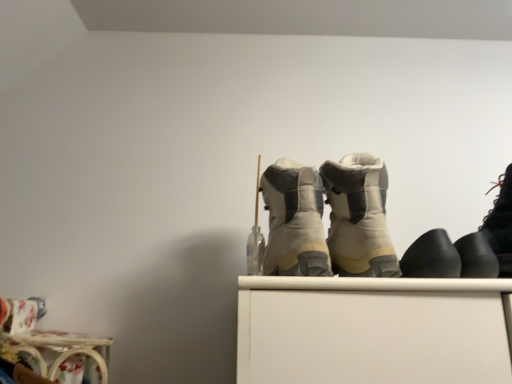
Question: From a real-world perspective, is black leather boot at right, positioned as the first footwear in right-to-left order, beneath black rubber shoes at right, which is the fourth footwear from left to right?

Choices:
 (A) no
 (B) yes

Answer: (A)

Question: Is black leather boot at right, positioned as the first footwear in right-to-left order, in front of black rubber shoes at right, the 2th footwear positioned from the right?

Choices:
 (A) no
 (B) yes

Answer: (B)

Question: Is black leather boot at right, positioned as the first footwear in right-to-left order, thinner than black rubber shoes at right, which is the fourth footwear from left to right?

Choices:
 (A) no
 (B) yes

Answer: (A)

Question: From a real-world perspective, is black leather boot at right, the fifth footwear positioned from the left, on top of black rubber shoes at right, which is the fourth footwear from left to right?

Choices:
 (A) yes
 (B) no

Answer: (A)

Question: Does black leather boot at right, positioned as the first footwear in right-to-left order, have a lesser height compared to black rubber shoes at right, the 2th footwear positioned from the right?

Choices:
 (A) no
 (B) yes

Answer: (A)

Question: Could you tell me if black leather boot at right, the fifth footwear positioned from the left, is facing black rubber shoes at right, the 2th footwear positioned from the right?

Choices:
 (A) no
 (B) yes

Answer: (A)

Question: Is beige suede boots at center, which appears as the fourth footwear when viewed from the right, positioned before beige suede boots at center, which is counted as the 1th footwear, starting from the left?

Choices:
 (A) no
 (B) yes

Answer: (A)

Question: From a real-world perspective, is beige suede boots at center, positioned as the second footwear in left-to-right order, on beige suede boots at center, which is counted as the 1th footwear, starting from the left?

Choices:
 (A) yes
 (B) no

Answer: (A)

Question: From a real-world perspective, is beige suede boots at center, which appears as the fourth footwear when viewed from the right, positioned under beige suede boots at center, which is counted as the 1th footwear, starting from the left, based on gravity?

Choices:
 (A) no
 (B) yes

Answer: (A)

Question: Considering the relative sizes of beige suede boots at center, which appears as the fourth footwear when viewed from the right, and beige suede boots at center, placed as the fifth footwear when sorted from right to left, in the image provided, is beige suede boots at center, which appears as the fourth footwear when viewed from the right, taller than beige suede boots at center, placed as the fifth footwear when sorted from right to left,?

Choices:
 (A) no
 (B) yes

Answer: (B)

Question: Is beige suede boots at center, positioned as the second footwear in left-to-right order, directly adjacent to beige suede boots at center, which is counted as the 1th footwear, starting from the left?

Choices:
 (A) yes
 (B) no

Answer: (A)

Question: From the image's perspective, does beige suede boots at center, positioned as the second footwear in left-to-right order, appear lower than beige suede boots at center, placed as the fifth footwear when sorted from right to left?

Choices:
 (A) no
 (B) yes

Answer: (B)

Question: From the image's perspective, is beige suede boots at center, which appears as the fourth footwear when viewed from the right, located beneath black matte boot at right, marked as the third footwear in a right-to-left arrangement?

Choices:
 (A) no
 (B) yes

Answer: (A)